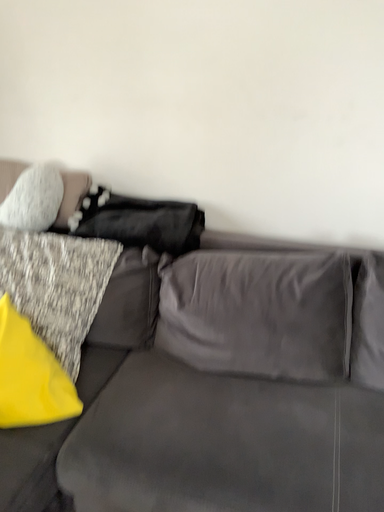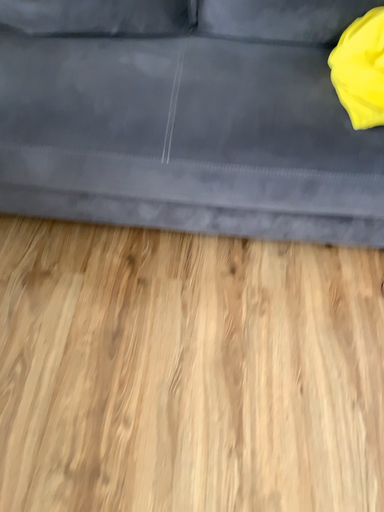
Question: Which way did the camera rotate in the video?

Choices:
 (A) rotated downward
 (B) rotated upward

Answer: (A)